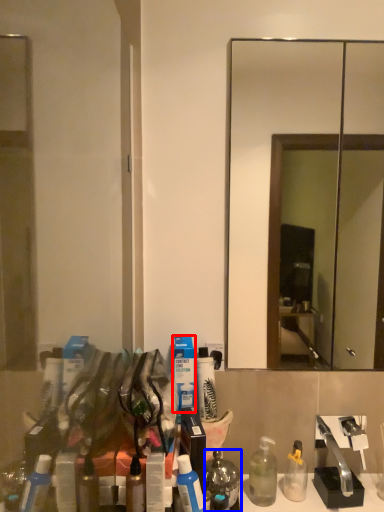
Question: Which object appears closest to the camera in this image, toiletry (highlighted by a red box) or mouthwash (highlighted by a blue box)?

Choices:
 (A) toiletry
 (B) mouthwash

Answer: (B)